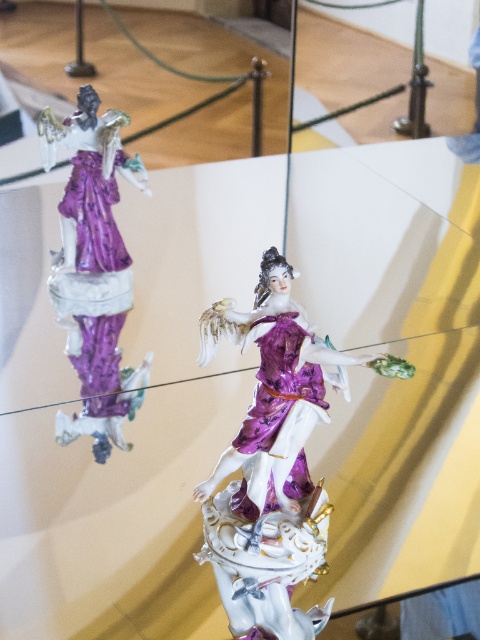
Question: Is porcelain statue at center thinner than matte porcelain dress at center?

Choices:
 (A) no
 (B) yes

Answer: (A)

Question: Among these points, which one is farthest from the camera?

Choices:
 (A) (298, 394)
 (B) (107, 333)
 (C) (266, 625)

Answer: (B)

Question: Is porcelain statue at left wider than matte porcelain dress at center?

Choices:
 (A) yes
 (B) no

Answer: (A)

Question: Based on their relative distances, which object is farther from the matte porcelain dress at center?

Choices:
 (A) porcelain statue at center
 (B) porcelain statue at left

Answer: (B)

Question: Can you confirm if porcelain statue at left is positioned to the left of matte porcelain dress at center?

Choices:
 (A) yes
 (B) no

Answer: (A)

Question: Which of the following is the farthest from the observer?

Choices:
 (A) (269, 433)
 (B) (129, 116)

Answer: (B)